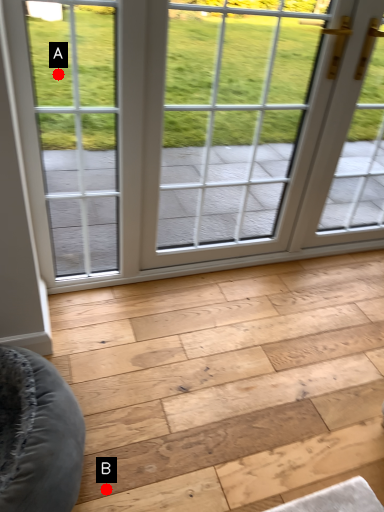
Question: Two points are circled on the image, labeled by A and B beside each circle. Which point is farther to the camera?

Choices:
 (A) A is further
 (B) B is further

Answer: (A)